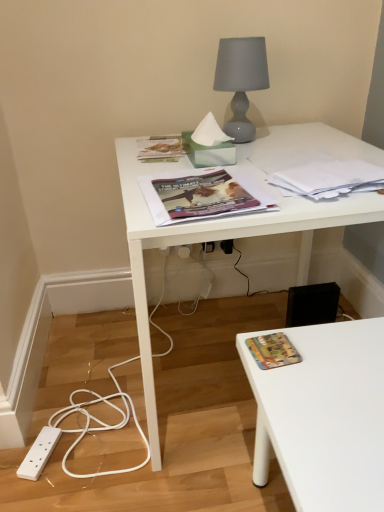
The height and width of the screenshot is (512, 384). In order to click on free region under white glossy desk at upper center (from a real-world perspective) in this screenshot , I will do `click(213, 356)`.